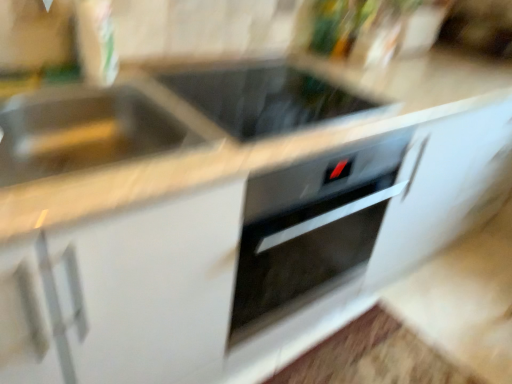
Find the location of a particular element. The height and width of the screenshot is (384, 512). metallic silver sink at left is located at coordinates (83, 131).

Describe the element at coordinates (83, 131) in the screenshot. I see `metallic silver sink at left` at that location.

What is the approximate height of black glass cooktop at center?

2.64 inches.

The width and height of the screenshot is (512, 384). What do you see at coordinates (268, 99) in the screenshot?
I see `black glass cooktop at center` at bounding box center [268, 99].

Identify the location of black glass cooktop at center. Image resolution: width=512 pixels, height=384 pixels. (268, 99).

At what (x,y) coordinates should I click in order to perform the action: click on metallic silver sink at left. Please return your answer as a coordinate pair (x, y). The image size is (512, 384). Looking at the image, I should click on (83, 131).

Based on the photo, in the image, is black glass cooktop at center on the left side or the right side of metallic silver sink at left?

Clearly, black glass cooktop at center is on the right of metallic silver sink at left in the image.

Between black glass cooktop at center and metallic silver sink at left, which one is positioned in front?

metallic silver sink at left.

Considering the positions of points (266, 75) and (17, 115), is point (266, 75) farther from camera compared to point (17, 115)?

Yes, point (266, 75) is farther from viewer.

From the image's perspective, is black glass cooktop at center above metallic silver sink at left?

Yes.

In the scene shown: From a real-world perspective, which is physically below, black glass cooktop at center or metallic silver sink at left?

From a 3D spatial view, metallic silver sink at left is below.

Which of these two, black glass cooktop at center or metallic silver sink at left, is wider?

black glass cooktop at center is wider.

Considering the sizes of black glass cooktop at center and metallic silver sink at left in the image, is black glass cooktop at center taller or shorter than metallic silver sink at left?

Considering their sizes, black glass cooktop at center has less height than metallic silver sink at left.

Looking at the image, does black glass cooktop at center seem bigger or smaller compared to metallic silver sink at left?

Clearly, black glass cooktop at center is smaller in size than metallic silver sink at left.

Is black glass cooktop at center inside or outside of metallic silver sink at left?

black glass cooktop at center is not inside metallic silver sink at left, it's outside.

Is black glass cooktop at center positioned far away from metallic silver sink at left?

No, black glass cooktop at center is not far away from metallic silver sink at left.

Is black glass cooktop at center oriented towards metallic silver sink at left?

No, black glass cooktop at center does not turn towards metallic silver sink at left.

How far apart are black glass cooktop at center and metallic silver sink at left?

black glass cooktop at center and metallic silver sink at left are 13.97 inches apart from each other.

Locate an element on the screen. sink below the black glass cooktop at center (from a real-world perspective) is located at coordinates (83, 131).

Which object is positioned more to the left, metallic silver sink at left or black glass cooktop at center?

metallic silver sink at left.

Between metallic silver sink at left and black glass cooktop at center, which one is positioned in front?

metallic silver sink at left is closer to the camera.

Does point (130, 158) come in front of point (277, 103)?

Yes, it is.

From the image's perspective, would you say metallic silver sink at left is shown under black glass cooktop at center?

Correct, metallic silver sink at left appears lower than black glass cooktop at center in the image.

From a real-world perspective, who is located higher, metallic silver sink at left or black glass cooktop at center?

black glass cooktop at center.

Considering the sizes of objects metallic silver sink at left and black glass cooktop at center in the image provided, who is wider, metallic silver sink at left or black glass cooktop at center?

Wider between the two is black glass cooktop at center.

Based on the photo, considering the sizes of metallic silver sink at left and black glass cooktop at center in the image, is metallic silver sink at left taller or shorter than black glass cooktop at center?

Considering their sizes, metallic silver sink at left has more height than black glass cooktop at center.

Who is bigger, metallic silver sink at left or black glass cooktop at center?

metallic silver sink at left.

Is black glass cooktop at center inside metallic silver sink at left?

No, black glass cooktop at center is not inside metallic silver sink at left.

Is metallic silver sink at left not close to black glass cooktop at center?

No.

Could you tell me if metallic silver sink at left is facing black glass cooktop at center?

No, metallic silver sink at left is not oriented towards black glass cooktop at center.

Find the location of `sink lying below the black glass cooktop at center (from the image's perspective)`. sink lying below the black glass cooktop at center (from the image's perspective) is located at coordinates (83, 131).

Where is `sink on the left of the black glass cooktop at center`? This screenshot has width=512, height=384. sink on the left of the black glass cooktop at center is located at coordinates (83, 131).

Where is `appliance that appears on the right of metallic silver sink at left`? appliance that appears on the right of metallic silver sink at left is located at coordinates (268, 99).